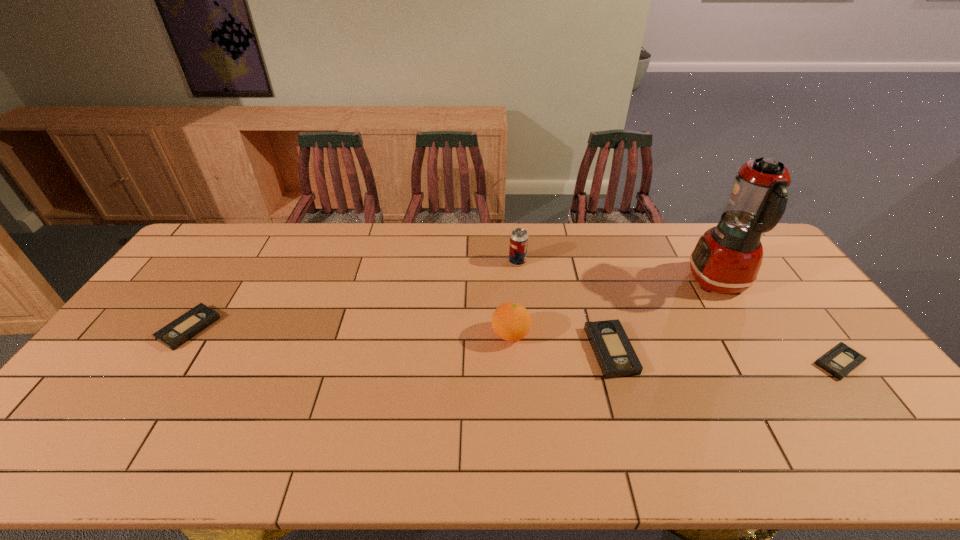
This screenshot has width=960, height=540. In order to click on vacant space located 0.400m on the back of the leftmost object in this screenshot , I will do `click(253, 232)`.

The image size is (960, 540). I want to click on vacant space located 0.230m on the back of the third shortest object, so click(589, 274).

The width and height of the screenshot is (960, 540). What are the coordinates of `vacant space located 0.300m on the back of the rightmost videotape` in the screenshot? It's located at (773, 276).

The width and height of the screenshot is (960, 540). I want to click on free region located 0.160m on the back of the beer can, so click(515, 230).

Find the location of a particular element. This screenshot has height=540, width=960. vacant region located 0.280m on the controls of the tallest object is located at coordinates (603, 282).

The width and height of the screenshot is (960, 540). Find the location of `vacant space situated on the controls of the tallest object`. vacant space situated on the controls of the tallest object is located at coordinates (607, 282).

The width and height of the screenshot is (960, 540). Find the location of `free space located 0.380m on the controls of the tallest object`. free space located 0.380m on the controls of the tallest object is located at coordinates (572, 282).

The width and height of the screenshot is (960, 540). Identify the location of vacant space located on the front of the orange. (515, 393).

Find the location of a particular element. beer can located at the far edge is located at coordinates (518, 246).

Locate an element on the screen. Image resolution: width=960 pixels, height=540 pixels. food processor at the far edge is located at coordinates (727, 258).